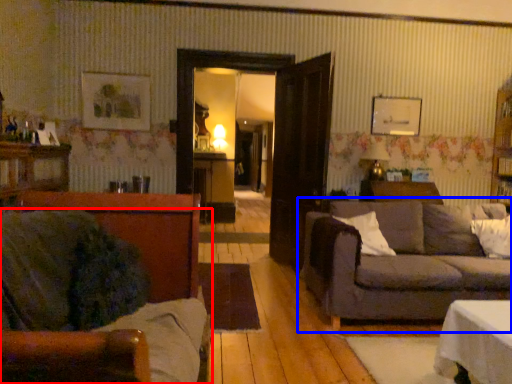
Question: Among these objects, which one is farthest to the camera, studio couch (highlighted by a red box) or studio couch (highlighted by a blue box)?

Choices:
 (A) studio couch
 (B) studio couch

Answer: (B)